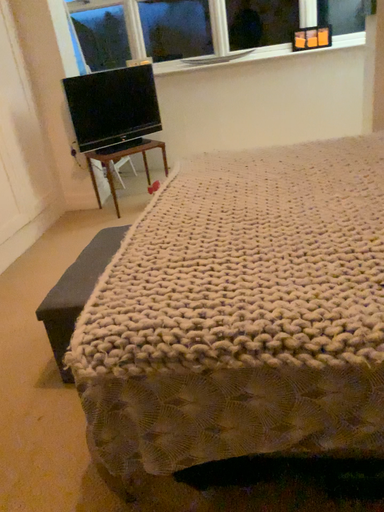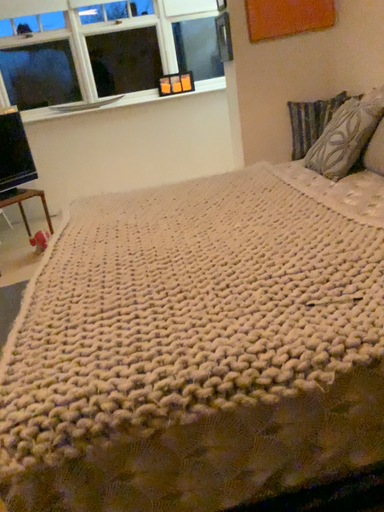
Question: Which way did the camera rotate in the video?

Choices:
 (A) rotated left
 (B) rotated right

Answer: (B)